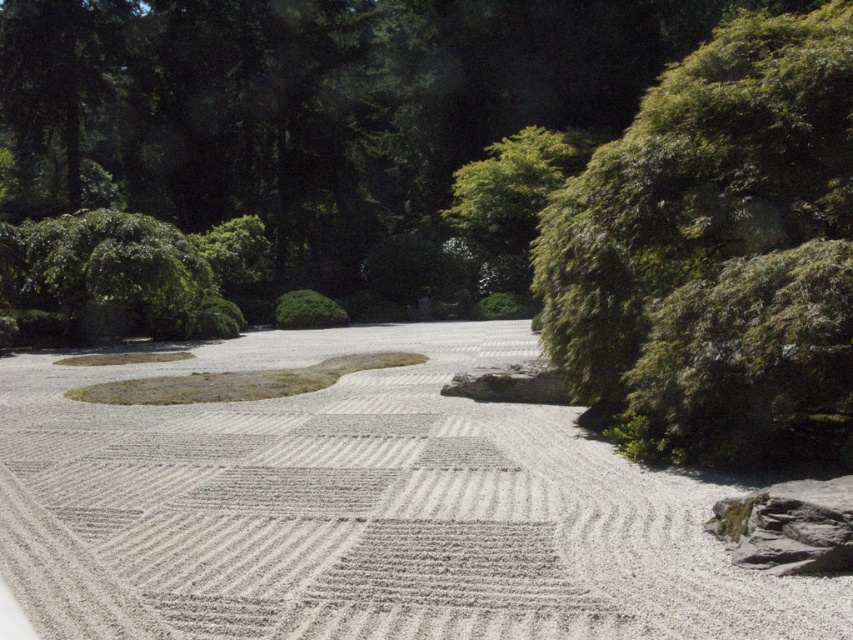
Consider the image. You are a gardener planning to place a small bonsai tree between the white textured gravel at center and the smooth gray rock at center. Based on their positions, which object should the bonsai tree be closer to?

The white textured gravel at center is to the left of the smooth gray rock at center, so the bonsai tree should be placed closer to the smooth gray rock at center to maintain symmetry in the garden layout.

You are standing at the entrance of the Japanese rock garden and want to walk directly to the white textured gravel at center. According to the garden layout, where should you head? Please provide coordinates in the format of a point like this example format of point format is not provided, so just describe the direction based on the scene description.

The white textured gravel at center is located at point (361, 509), so you should head towards the center of the garden where the gravel pathway is situated.

In the serene Japanese rock garden, you notice the white textured gravel at center and the smooth gray rock at center. Which object takes up more space in the garden?

The white textured gravel at center has a larger size compared to the smooth gray rock at center, so it takes up more space in the garden.